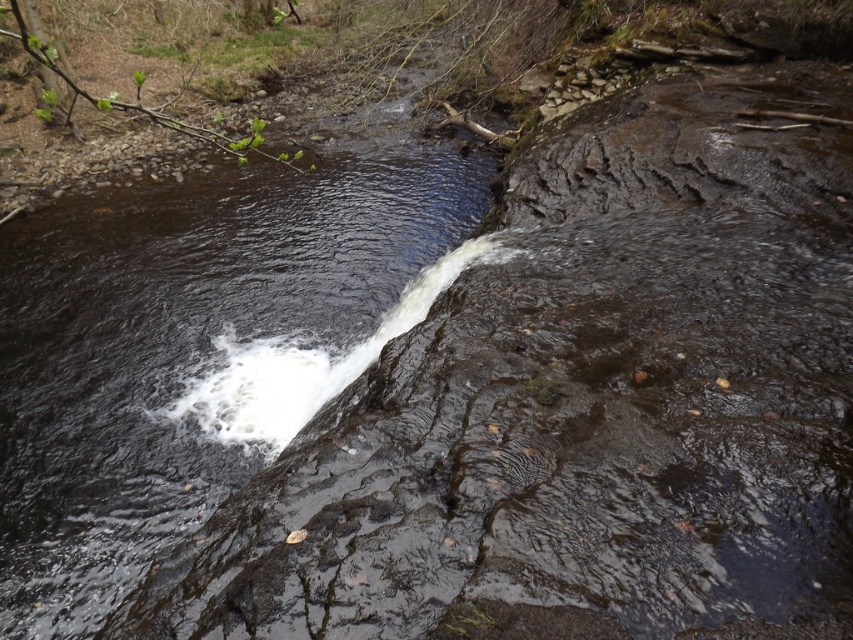
The width and height of the screenshot is (853, 640). What do you see at coordinates (194, 348) in the screenshot?
I see `dark wet rock at center` at bounding box center [194, 348].

Is dark wet rock at center to the left of white frothy water at center from the viewer's perspective?

Indeed, dark wet rock at center is positioned on the left side of white frothy water at center.

Which is behind, point (189, 205) or point (276, 436)?

Point (189, 205)

Locate an element on the screen. Image resolution: width=853 pixels, height=640 pixels. dark wet rock at center is located at coordinates coord(194,348).